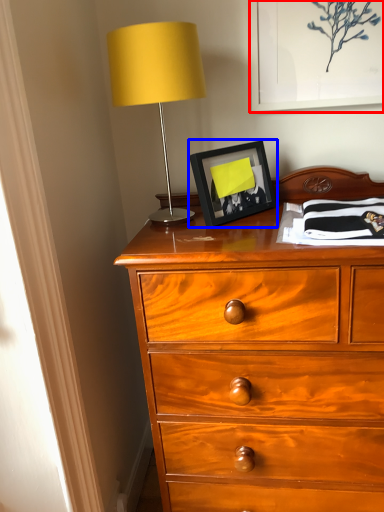
Question: Which of the following is the farthest to the observer, picture frame (highlighted by a red box) or picture frame (highlighted by a blue box)?

Choices:
 (A) picture frame
 (B) picture frame

Answer: (A)